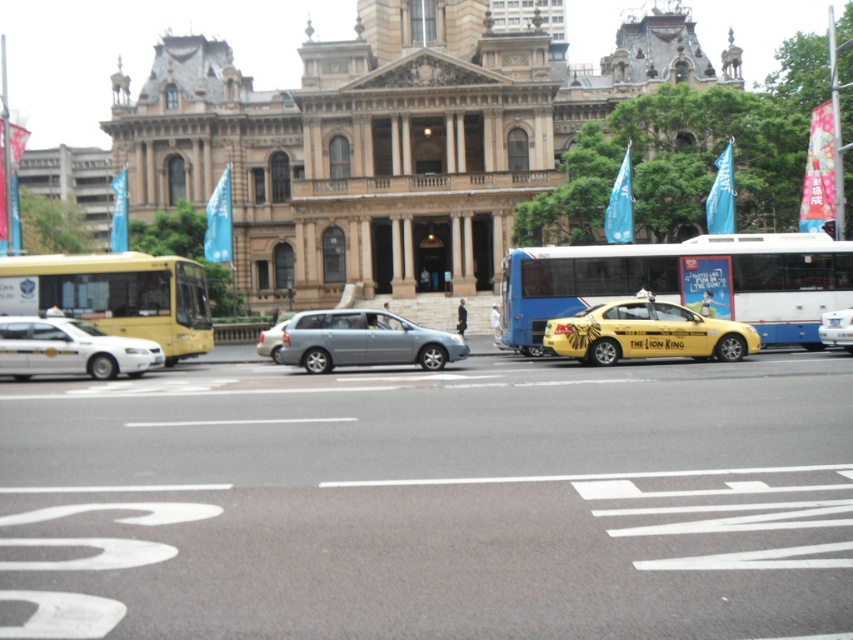
From the picture: You are a pedestrian waiting to cross the street in front of the grand historic building. You see a yellow matte taxi at center and a satin silver van at center. Which vehicle should you avoid stepping in front of when crossing?

You should avoid stepping in front of the yellow matte taxi at center because it is positioned to the right of the satin silver van at center, meaning it is closer to your path as a pedestrian crossing from the left side.

You are standing at the point labeled as point (115, 296) in the image. What object is located at this point?

The point (115, 296) indicates the yellow matte bus at left.